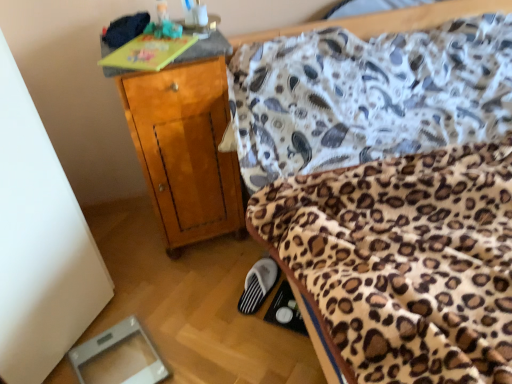
Question: Should I look upward or downward to see black suede slipper at lower center?

Choices:
 (A) up
 (B) down

Answer: (B)

Question: Is wooden nightstand at upper left positioned far away from black suede slipper at lower center?

Choices:
 (A) no
 (B) yes

Answer: (A)

Question: Is wooden nightstand at upper left surrounding black suede slipper at lower center?

Choices:
 (A) yes
 (B) no

Answer: (B)

Question: Is wooden nightstand at upper left touching black suede slipper at lower center?

Choices:
 (A) yes
 (B) no

Answer: (B)

Question: From the image's perspective, is wooden nightstand at upper left located beneath black suede slipper at lower center?

Choices:
 (A) yes
 (B) no

Answer: (B)

Question: From the image's perspective, is wooden nightstand at upper left on top of black suede slipper at lower center?

Choices:
 (A) no
 (B) yes

Answer: (B)

Question: Is wooden nightstand at upper left taller than black suede slipper at lower center?

Choices:
 (A) yes
 (B) no

Answer: (A)

Question: Is black suede slipper at lower center smaller than wooden nightstand at upper left?

Choices:
 (A) yes
 (B) no

Answer: (A)

Question: Is black suede slipper at lower center shorter than wooden nightstand at upper left?

Choices:
 (A) yes
 (B) no

Answer: (A)

Question: Can you confirm if black suede slipper at lower center is bigger than wooden nightstand at upper left?

Choices:
 (A) yes
 (B) no

Answer: (B)

Question: Can you confirm if black suede slipper at lower center is wider than wooden nightstand at upper left?

Choices:
 (A) no
 (B) yes

Answer: (A)

Question: Considering the relative positions of black suede slipper at lower center and wooden nightstand at upper left in the image provided, is black suede slipper at lower center to the right of wooden nightstand at upper left from the viewer's perspective?

Choices:
 (A) no
 (B) yes

Answer: (B)

Question: Considering the relative positions of black suede slipper at lower center and wooden nightstand at upper left in the image provided, is black suede slipper at lower center in front of wooden nightstand at upper left?

Choices:
 (A) yes
 (B) no

Answer: (B)

Question: Considering the relative positions of wooden nightstand at upper left and black suede slipper at lower center in the image provided, is wooden nightstand at upper left to the left or to the right of black suede slipper at lower center?

Choices:
 (A) right
 (B) left

Answer: (B)